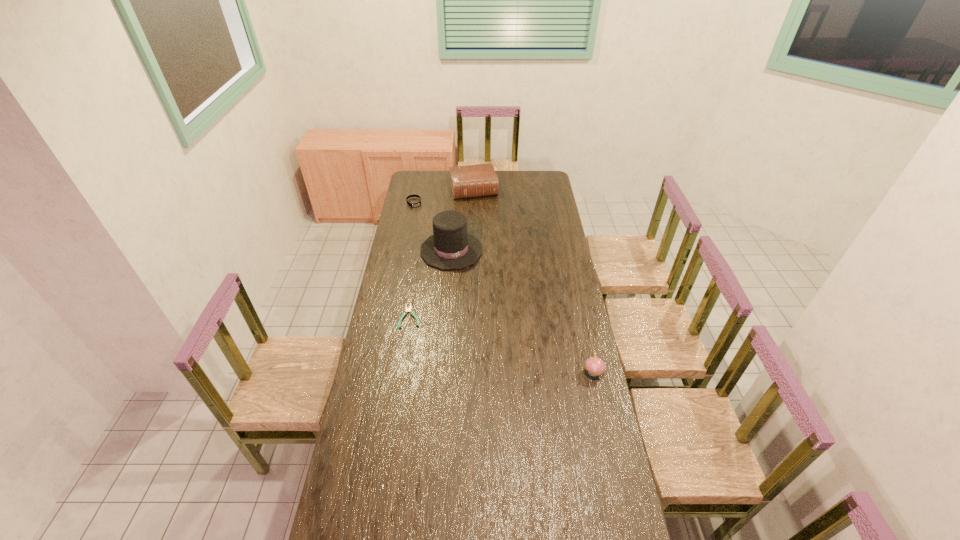
This screenshot has width=960, height=540. What are the coordinates of `vacant spot on the desktop that is between the shortest object and the rightmost object and is positioned on the front of the dress hat with the decoration` in the screenshot? It's located at (490, 340).

Identify the location of free space on the desktop that is between the pliers and the nearest object and is positioned on the display of the wristband. (469, 334).

This screenshot has width=960, height=540. I want to click on free space on the desktop that is between the fourth farthest object and the rightmost object and is positioned on the spine side of the Bible, so click(x=519, y=349).